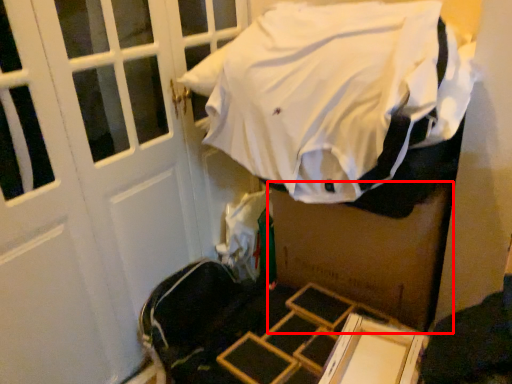
Question: From the image's perspective, considering the relative positions of box (annotated by the red box) and sheet in the image provided, where is box (annotated by the red box) located with respect to the staircase?

Choices:
 (A) above
 (B) below

Answer: (B)